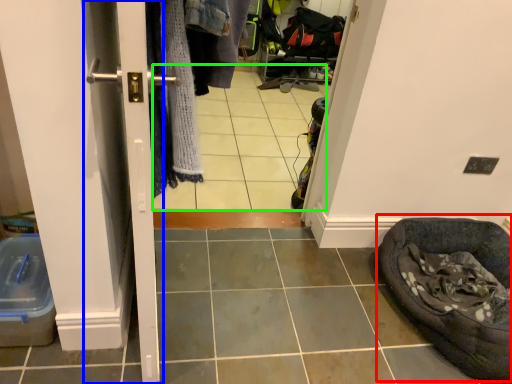
Question: Based on their relative distances, which object is nearer to bean bag chair (highlighted by a red box)? Choose from screen door (highlighted by a blue box) and tile (highlighted by a green box).

Choices:
 (A) screen door
 (B) tile

Answer: (A)